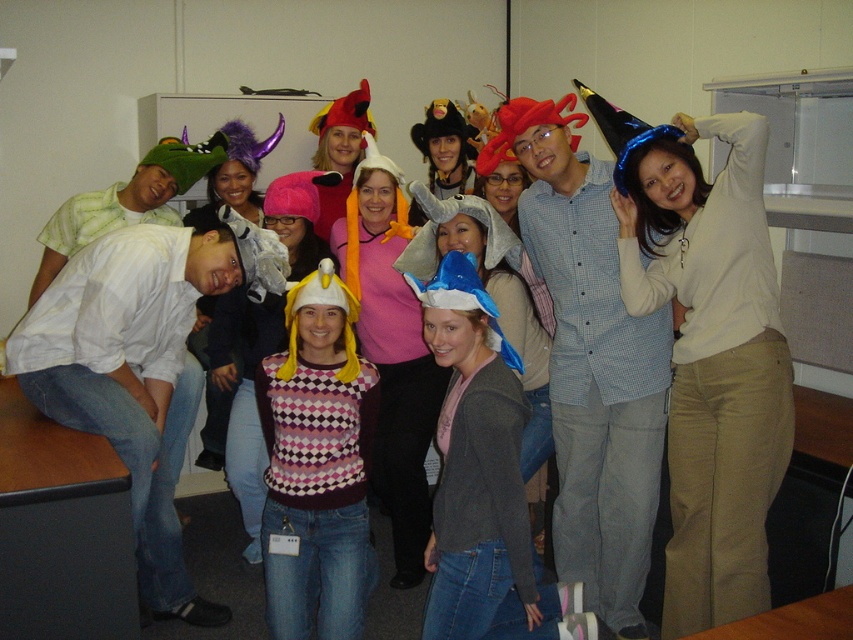
Question: Does checkered sweater at center appear on the right side of plaid sweater at center?

Choices:
 (A) yes
 (B) no

Answer: (A)

Question: Which is farther from the checkered fabric shirt at center?

Choices:
 (A) plaid sweater at center
 (B) checkered sweater at center
 (C) green fabric hat at left

Answer: (C)

Question: Which of the following is the closest to the observer?

Choices:
 (A) green fabric hat at left
 (B) checkered sweater at center
 (C) blue glitter party hat at upper right

Answer: (C)

Question: Among these points, which one is nearest to the camera?

Choices:
 (A) (112, 196)
 (B) (273, 182)
 (C) (392, 458)
 (D) (720, 417)

Answer: (D)

Question: Is checkered sweater at center below plaid sweater at center?

Choices:
 (A) yes
 (B) no

Answer: (B)

Question: Does blue glitter party hat at upper right have a greater width compared to checkered fabric shirt at center?

Choices:
 (A) yes
 (B) no

Answer: (B)